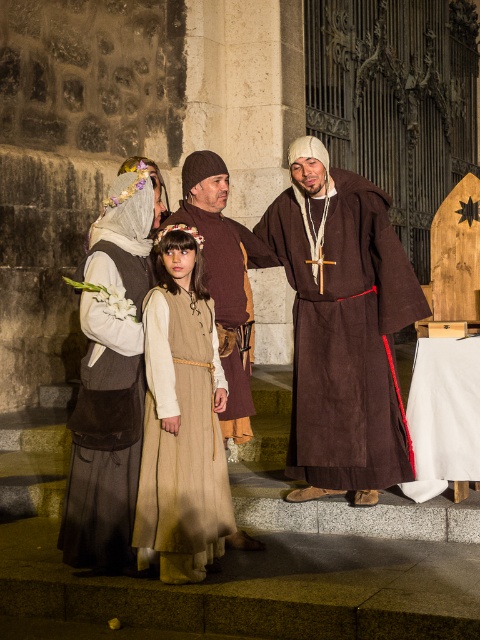
Measure the distance from brown suede robe at center to brown leather tunic at center.

brown suede robe at center is 68.70 centimeters from brown leather tunic at center.

Is point (330, 192) positioned behind point (212, 163)?

Yes, it is.

Measure the distance between point (319, 392) and camera.

Point (319, 392) is 8.86 meters away from camera.

The width and height of the screenshot is (480, 640). I want to click on brown suede robe at center, so click(x=342, y=324).

The width and height of the screenshot is (480, 640). Describe the element at coordinates (110, 378) in the screenshot. I see `matte brown vest at center` at that location.

Does matte brown vest at center appear on the left side of beige fabric dress at center?

Yes, matte brown vest at center is to the left of beige fabric dress at center.

Find the location of a particular element. Image resolution: width=480 pixels, height=640 pixels. matte brown vest at center is located at coordinates (110, 378).

Is point (344, 451) positioned after point (152, 346)?

That is True.

Between brown suede robe at center and beige fabric dress at center, which one is positioned lower?

Positioned lower is beige fabric dress at center.

Is point (351, 246) behind point (151, 560)?

Yes, it is.

Where is `brown suede robe at center`? brown suede robe at center is located at coordinates (342, 324).